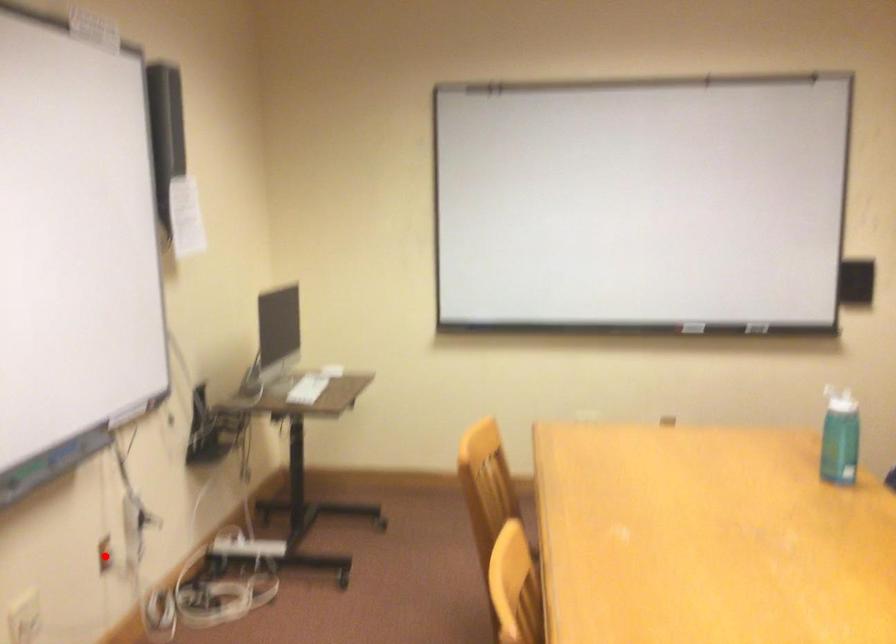
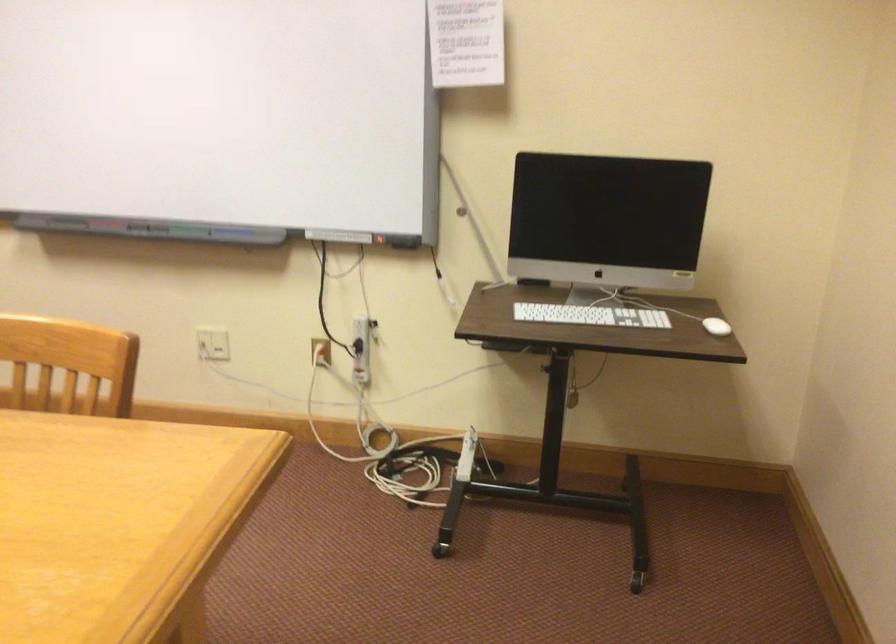
Question: A red point is marked in image1. In image2, is the corresponding 3D point closer to the camera or farther? Reply with the corresponding letter.

Choices:
 (A) The corresponding 3D point is closer.
 (B) The corresponding 3D point is farther.

Answer: (B)